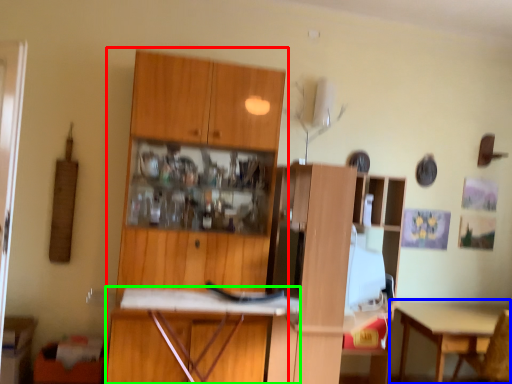
Question: Which object is the closest to the cabinetry (highlighted by a red box)? Choose among these: table (highlighted by a blue box) or desk (highlighted by a green box).

Choices:
 (A) table
 (B) desk

Answer: (B)